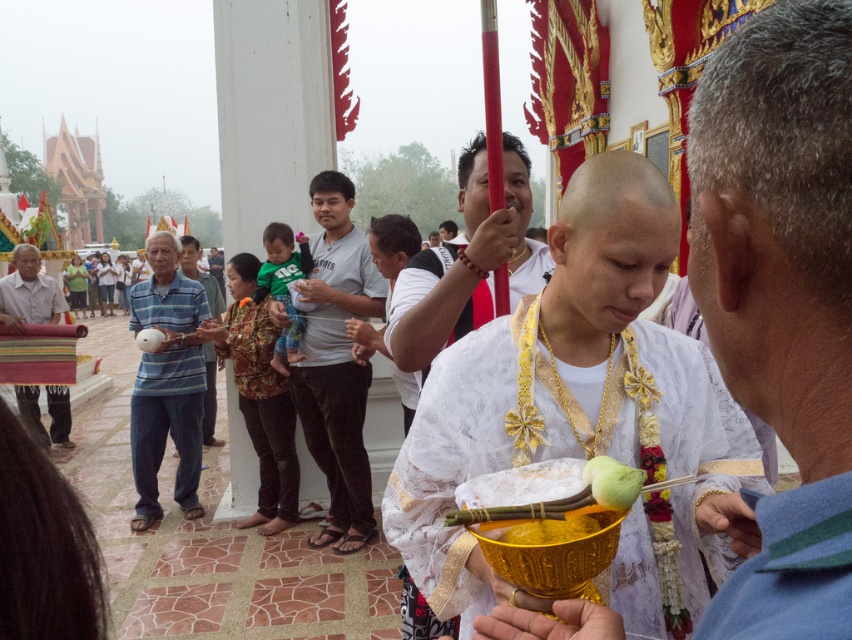
Question: Does white lace robe at center have a smaller size compared to striped cotton shirt at left?

Choices:
 (A) no
 (B) yes

Answer: (B)

Question: Which object is the farthest from the multicolored woven cloth at left?

Choices:
 (A) white clothed monk at center
 (B) gray cotton shirt at center
 (C) white lace robe at center
 (D) striped cotton shirt at left

Answer: (A)

Question: Observing the image, what is the correct spatial positioning of white clothed monk at center in reference to white matte bowl at center?

Choices:
 (A) right
 (B) left

Answer: (A)

Question: Can you confirm if striped cotton shirt at left is thinner than white matte bowl at center?

Choices:
 (A) no
 (B) yes

Answer: (B)

Question: Which point is closer to the camera?

Choices:
 (A) multicolored woven cloth at left
 (B) yellow matte coconut at center
 (C) white lace robe at center
 (D) striped cotton shirt at left

Answer: (A)

Question: Which object appears farthest from the camera in this image?

Choices:
 (A) gray cotton shirt at center
 (B) white matte bowl at center

Answer: (B)